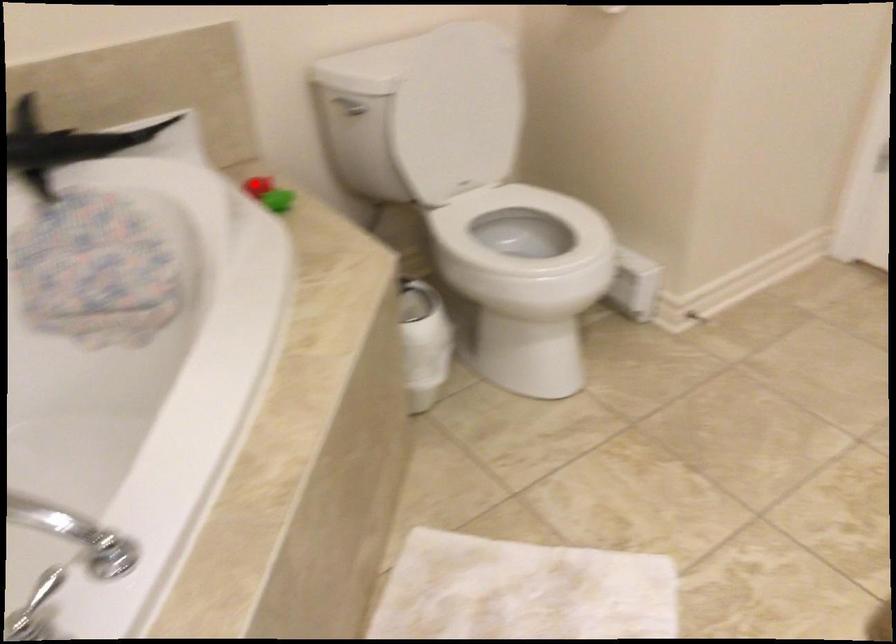
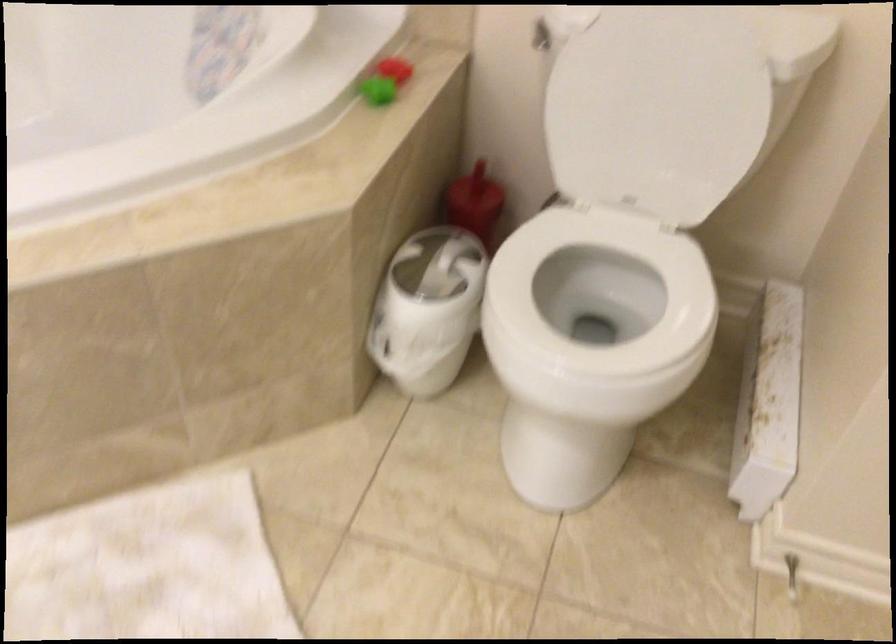
Question: I am providing you with two images of the same scene from different viewpoints. Given a red point in image1, look at the same physical point in image2. Is it:

Choices:
 (A) Closer to the viewpoint
 (B) Farther from the viewpoint

Answer: (A)